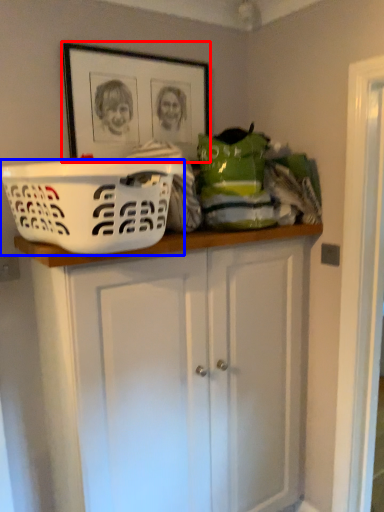
Question: Which object appears farthest to the camera in this image, picture frame (highlighted by a red box) or basket (highlighted by a blue box)?

Choices:
 (A) picture frame
 (B) basket

Answer: (A)